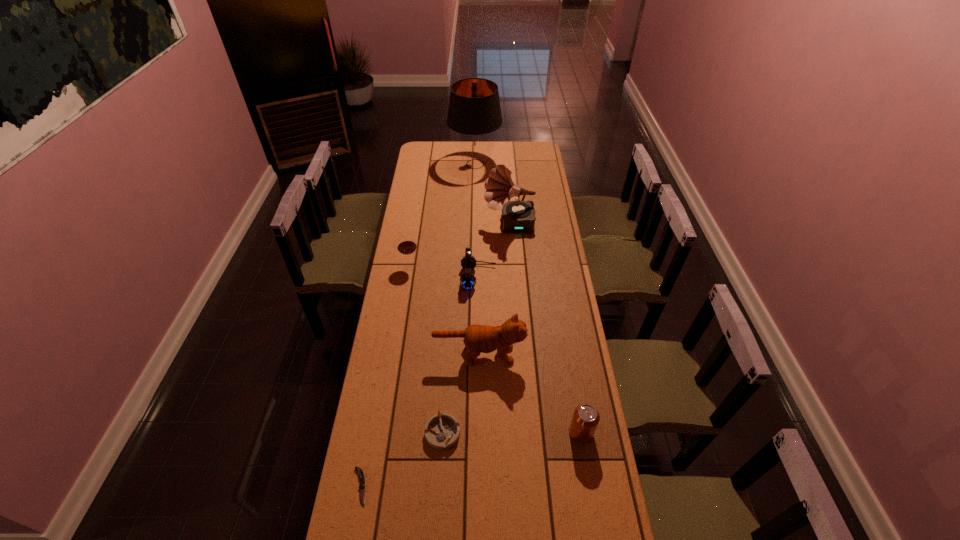
Find the location of `object that can be found as the third closest to the farthest object`. object that can be found as the third closest to the farthest object is located at coordinates (468, 281).

Point out which object is positioned as the nearest to the cat. Please provide its 2D coordinates. Your answer should be formatted as a tuple, i.e. [(x, y)], where the tuple contains the x and y coordinates of a point satisfying the conditions above.

[(442, 431)]

Where is `free location that satisfies the following two spatial constraints: 1. from the horn of the seventh shortest object; 2. on the front side of the ashtray`? The width and height of the screenshot is (960, 540). free location that satisfies the following two spatial constraints: 1. from the horn of the seventh shortest object; 2. on the front side of the ashtray is located at coordinates pyautogui.click(x=524, y=432).

You are a GUI agent. You are given a task and a screenshot of the screen. Output one action in this format:
    pyautogui.click(x=<x>, y=<y>)
    Task: Click on the free space that satisfies the following two spatial constraints: 1. on the back side of the second shortest object; 2. on the left side of the lampshade
    This screenshot has width=960, height=540.
    Given the screenshot: What is the action you would take?
    pyautogui.click(x=459, y=164)

This screenshot has height=540, width=960. In order to click on blank space that satisfies the following two spatial constraints: 1. on the back side of the seventh tallest object; 2. on the right side of the nearest object in this screenshot , I will do `click(370, 432)`.

Locate an element on the screen. Image resolution: width=960 pixels, height=540 pixels. free space that satisfies the following two spatial constraints: 1. on the back side of the wineglass; 2. on the left side of the farthest object is located at coordinates (426, 164).